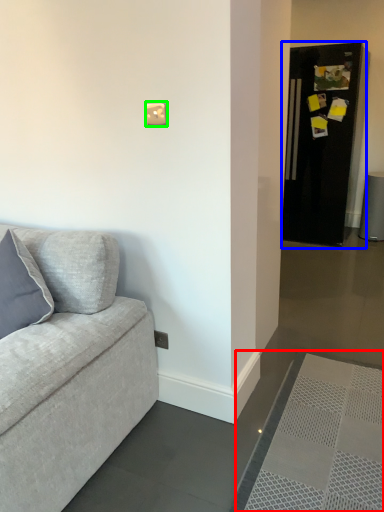
Question: Which object is positioned farthest from doormat (highlighted by a red box)? Select from fridge (highlighted by a blue box) and light switch (highlighted by a green box).

Choices:
 (A) fridge
 (B) light switch

Answer: (A)